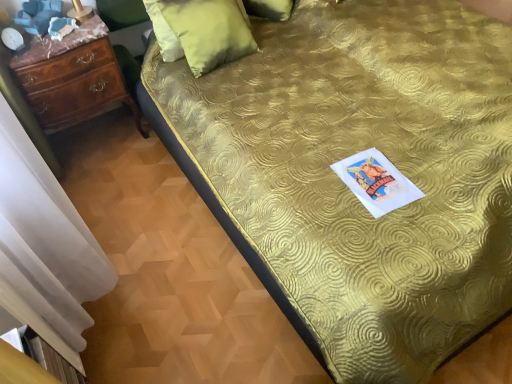
You are a GUI agent. You are given a task and a screenshot of the screen. Output one action in this format:
    pyautogui.click(x=<x>, y=<y>)
    Task: Click on the free space underneath white sheer curtain at left (from a real-world perspective)
    The width and height of the screenshot is (512, 384).
    Given the screenshot: What is the action you would take?
    pyautogui.click(x=114, y=313)